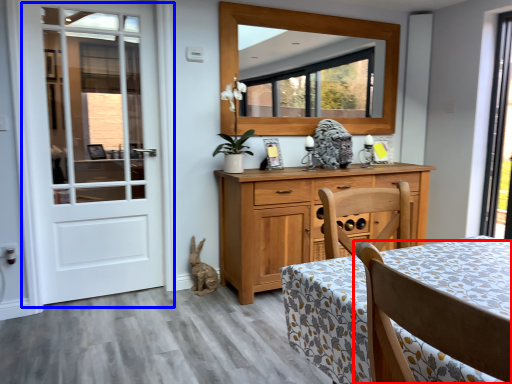
Question: Which object appears closest to the camera in this image, chair (highlighted by a red box) or door (highlighted by a blue box)?

Choices:
 (A) chair
 (B) door

Answer: (A)